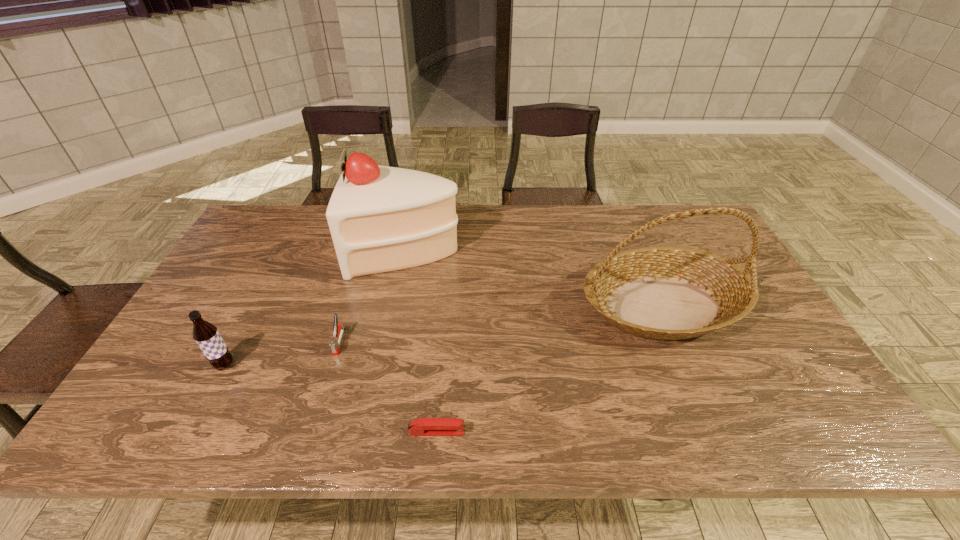
Image resolution: width=960 pixels, height=540 pixels. Identify the location of free space that is in between the rightmost object and the third tallest object. (444, 335).

Where is `free space between the nearer stapler and the basket`? The width and height of the screenshot is (960, 540). free space between the nearer stapler and the basket is located at coordinates (550, 368).

This screenshot has height=540, width=960. I want to click on unoccupied position between the cake and the fourth tallest object, so [x=373, y=296].

Find the location of `free space between the third tallest object and the basket`. free space between the third tallest object and the basket is located at coordinates (444, 335).

This screenshot has width=960, height=540. I want to click on the third closest object to the rightmost object, so click(x=338, y=330).

Locate which object ranks third in proximity to the cake. Please provide its 2D coordinates. Your answer should be formatted as a tuple, i.e. [(x, y)], where the tuple contains the x and y coordinates of a point satisfying the conditions above.

[(206, 335)]